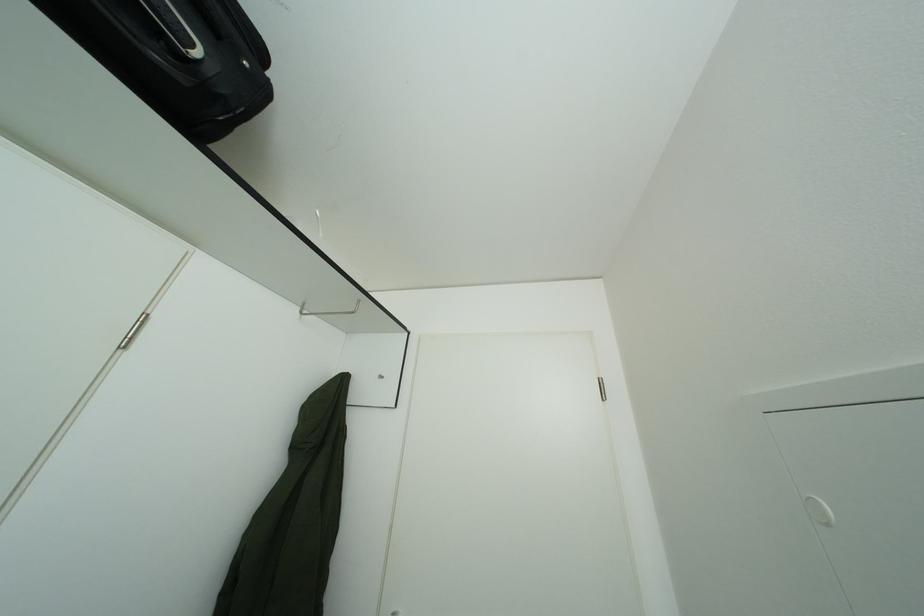
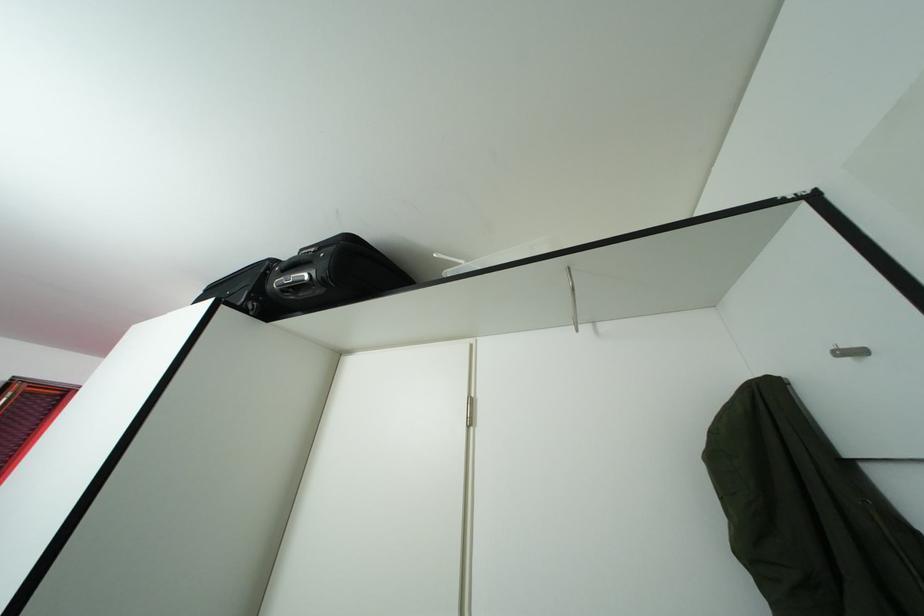
Where in the second image is the point corresponding to the point at 390,384 from the first image?

(861, 360)